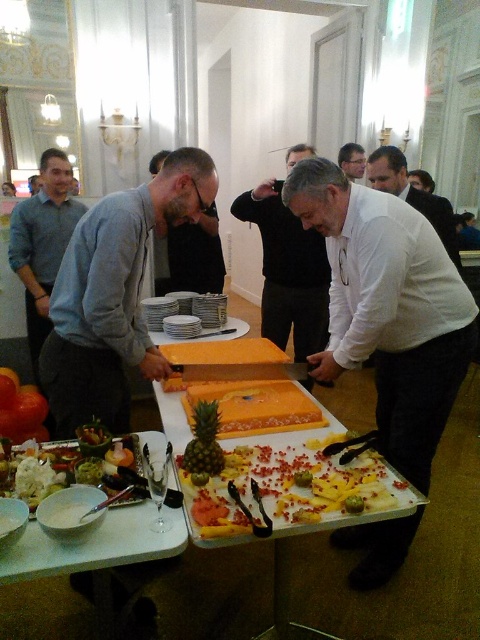
Is point (96, 540) positioned before point (27, 484)?

That is True.

Which of these two, white glossy bowls at center or white glossy bowl at lower left, stands shorter?

white glossy bowl at lower left is shorter.

Locate an element on the screen. white glossy bowls at center is located at coordinates (103, 557).

The image size is (480, 640). In order to click on white glossy bowls at center in this screenshot , I will do `click(103, 557)`.

Is dark gray shirt at center taller than white shirt at center?

Incorrect, dark gray shirt at center's height is not larger of white shirt at center's.

Who is more forward, (201, 227) or (367, 160)?

Point (201, 227) is in front.

Is point (213, 202) positioned before point (379, 173)?

Yes.

The image size is (480, 640). Identify the location of dark gray shirt at center. (195, 253).

Can you confirm if black matte sweater at center is shorter than yellow foam cake at center?

Incorrect, black matte sweater at center's height does not fall short of yellow foam cake at center's.

Can you confirm if black matte sweater at center is positioned to the right of yellow foam cake at center?

Indeed, black matte sweater at center is positioned on the right side of yellow foam cake at center.

Between point (308, 289) and point (251, 348), which one is positioned behind?

Point (308, 289)

Where is `black matte sweater at center`? This screenshot has width=480, height=640. black matte sweater at center is located at coordinates (288, 272).